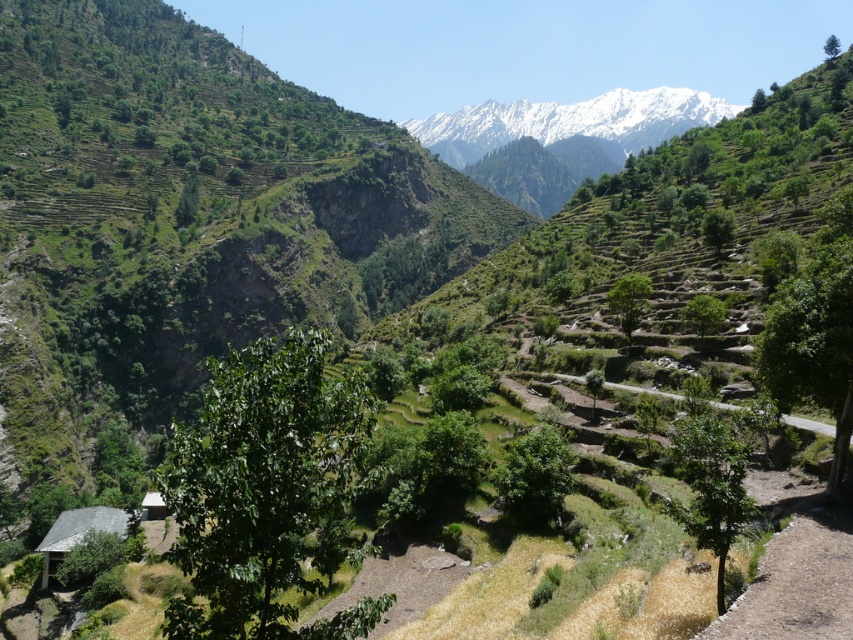
Question: Which of these objects is positioned closest to the white wooden hut at lower left?

Choices:
 (A) gray slate hut at lower left
 (B) white snow-covered mountain at upper center

Answer: (A)

Question: Which object appears closest to the camera in this image?

Choices:
 (A) gray slate hut at lower left
 (B) white wooden hut at lower left
 (C) white snow-covered mountain at upper center

Answer: (A)

Question: Which of the following is the closest to the observer?

Choices:
 (A) (109, 516)
 (B) (160, 515)

Answer: (A)

Question: Can you confirm if white snow-covered mountain at upper center is wider than gray slate hut at lower left?

Choices:
 (A) yes
 (B) no

Answer: (A)

Question: Considering the relative positions of white snow-covered mountain at upper center and gray slate hut at lower left in the image provided, where is white snow-covered mountain at upper center located with respect to gray slate hut at lower left?

Choices:
 (A) right
 (B) left

Answer: (A)

Question: Does white snow-covered mountain at upper center have a larger size compared to gray slate hut at lower left?

Choices:
 (A) yes
 (B) no

Answer: (A)